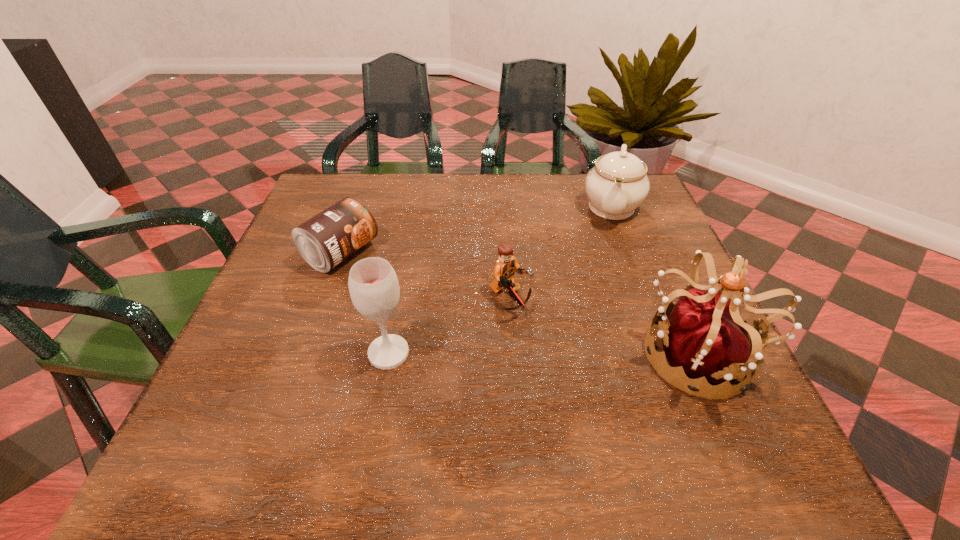
Identify the location of free space between the wineglass and the third object from left to right. The width and height of the screenshot is (960, 540). (449, 325).

This screenshot has width=960, height=540. Find the location of `vacant area that lies between the tiara and the Lego`. vacant area that lies between the tiara and the Lego is located at coordinates (606, 326).

Locate an element on the screen. This screenshot has width=960, height=540. unoccupied position between the third object from left to right and the tiara is located at coordinates (606, 326).

Select which object appears as the closest to the wineglass. Please provide its 2D coordinates. Your answer should be formatted as a tuple, i.e. [(x, y)], where the tuple contains the x and y coordinates of a point satisfying the conditions above.

[(505, 268)]

Locate which object is the second closest to the can. Please provide its 2D coordinates. Your answer should be formatted as a tuple, i.e. [(x, y)], where the tuple contains the x and y coordinates of a point satisfying the conditions above.

[(505, 268)]

At what (x,y) coordinates should I click in order to perform the action: click on free point that satisfies the following two spatial constraints: 1. on the front side of the third tallest object; 2. on the front-facing side of the tiara. Please return your answer as a coordinate pair (x, y). Image resolution: width=960 pixels, height=540 pixels. Looking at the image, I should click on (667, 354).

This screenshot has height=540, width=960. Find the location of `vacant space that satisfies the following two spatial constraints: 1. on the front side of the fourth object from right to left; 2. on the front-facing side of the tiara`. vacant space that satisfies the following two spatial constraints: 1. on the front side of the fourth object from right to left; 2. on the front-facing side of the tiara is located at coordinates (389, 354).

Find the location of a particular element. This screenshot has width=960, height=540. free space in the image that satisfies the following two spatial constraints: 1. on the back side of the third shortest object; 2. on the right side of the wineglass is located at coordinates (416, 206).